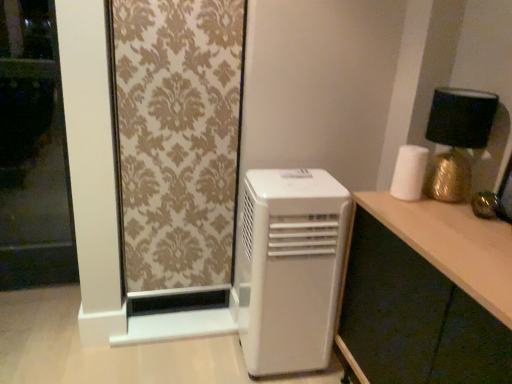
Locate an element on the screen. The image size is (512, 384). free space in front of white matte paper towel at right is located at coordinates point(413,211).